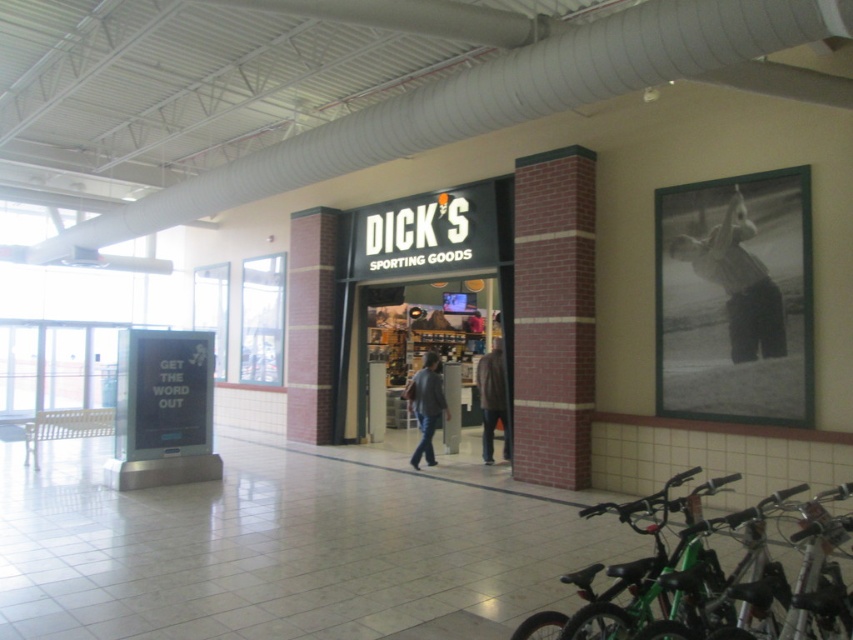
Question: Based on their relative distances, which object is farther from the dark brown jacket at center?

Choices:
 (A) black matte dick's sporting goods at center
 (B) green matte bicycle at lower right
 (C) black textured shirt at upper right

Answer: (B)

Question: Which point is farther to the camera?

Choices:
 (A) (497, 365)
 (B) (421, 444)

Answer: (A)

Question: Is green matte bicycle at lower right further to the viewer compared to denim jacket at center?

Choices:
 (A) no
 (B) yes

Answer: (A)

Question: Observing the image, what is the correct spatial positioning of green matte bicycle at lower right in reference to black textured shirt at upper right?

Choices:
 (A) below
 (B) above

Answer: (A)

Question: Is green matte bicycle at lower right above dark brown jacket at center?

Choices:
 (A) no
 (B) yes

Answer: (A)

Question: Which of these objects is positioned farthest from the black matte dick's sporting goods at center?

Choices:
 (A) dark brown jacket at center
 (B) green matte bicycle at lower right

Answer: (B)